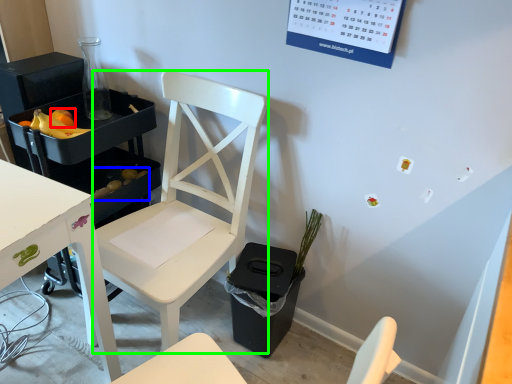
Question: Which object is the farthest from fruit (highlighted by a red box)? Choose among these: food (highlighted by a blue box) or chair (highlighted by a green box).

Choices:
 (A) food
 (B) chair

Answer: (B)